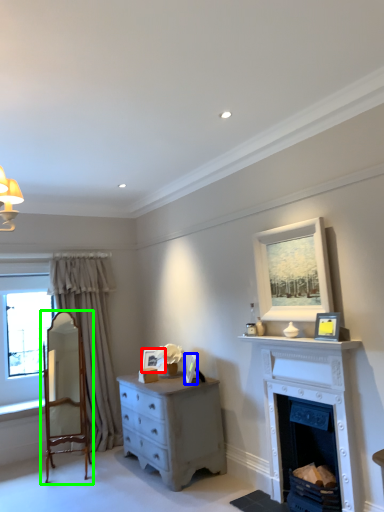
Question: Based on their relative distances, which object is nearer to picture frame (highlighted by a red box)? Choose from picture frame (highlighted by a blue box) and chair (highlighted by a green box).

Choices:
 (A) picture frame
 (B) chair

Answer: (A)